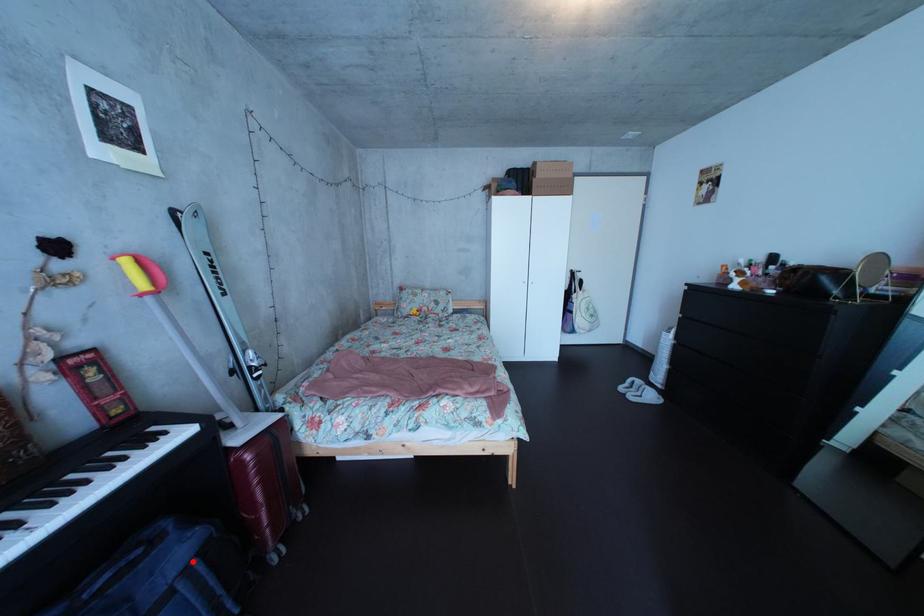
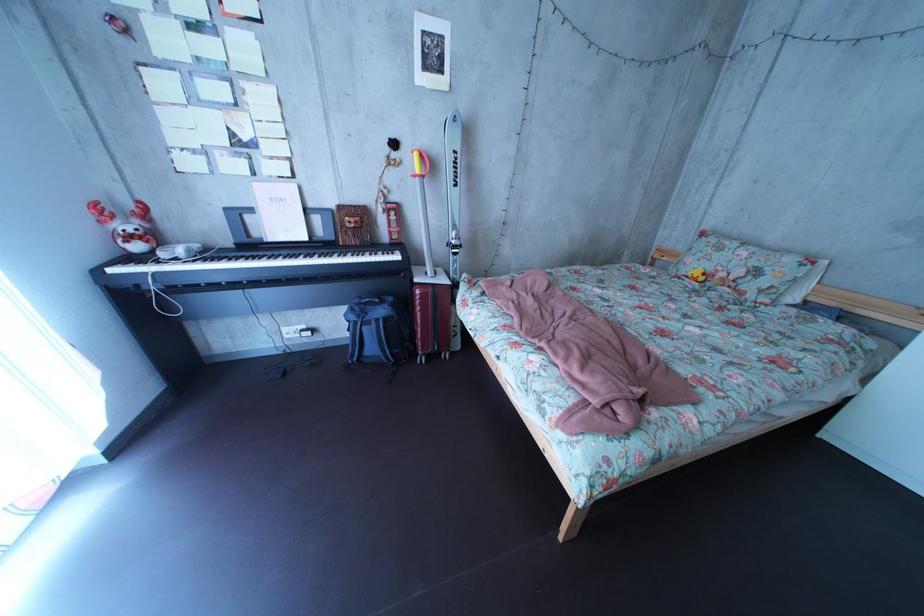
The point at the highlighted location is marked in the first image. Where is the corresponding point in the second image?

(395, 320)